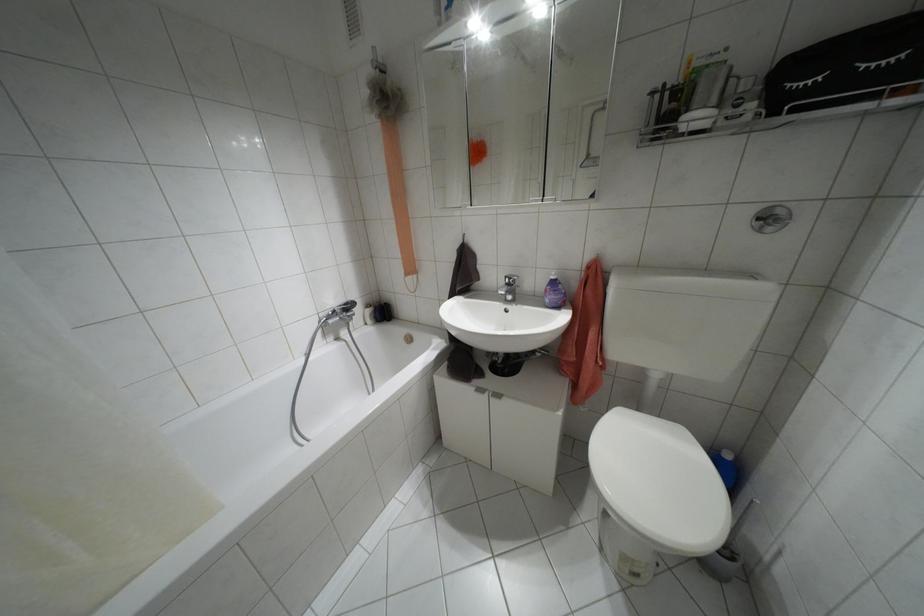
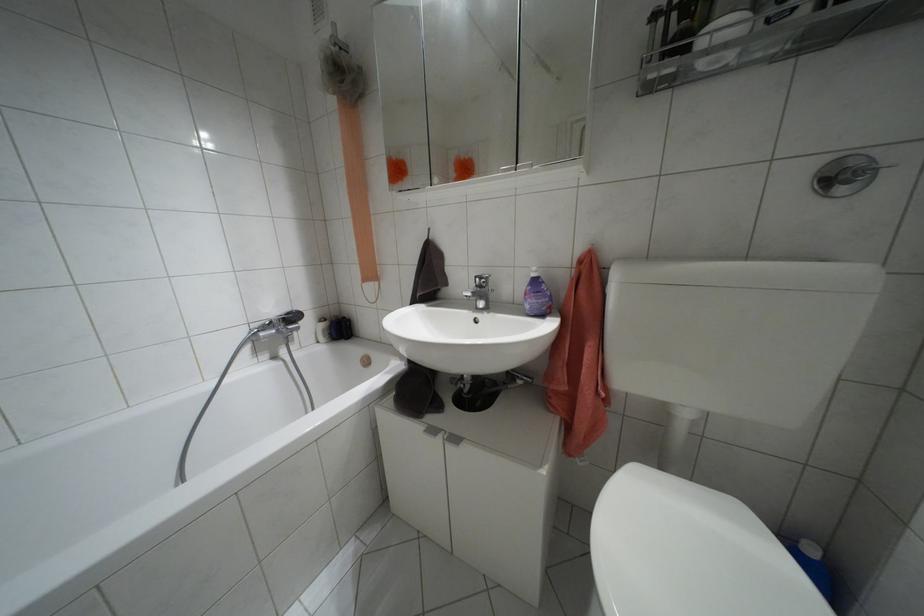
Locate, in the second image, the point that corresponds to [552,277] in the first image.

(532, 274)